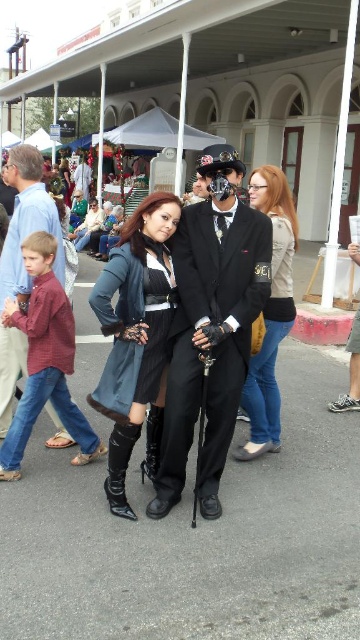
Identify the location of matte black coat at center. The width and height of the screenshot is (360, 640). (136, 339).

Who is positioned more to the right, matte black coat at center or plaid shirt at left?

Positioned to the right is matte black coat at center.

Find the location of a particular element. The height and width of the screenshot is (640, 360). matte black coat at center is located at coordinates pyautogui.click(x=136, y=339).

Does shiny black suit at center have a greater height compared to plaid shirt at left?

Indeed, shiny black suit at center has a greater height compared to plaid shirt at left.

Does shiny black suit at center have a lesser height compared to plaid shirt at left?

No.

Who is more forward, (266, 292) or (16, 368)?

Point (266, 292) is more forward.

You are a GUI agent. You are given a task and a screenshot of the screen. Output one action in this format:
    pyautogui.click(x=<x>, y=<y>)
    Task: Click on the shiny black suit at center
    
    Given the screenshot: What is the action you would take?
    (x=210, y=326)

Does point (78, 452) lie behind point (150, 342)?

Yes, it is.

Can you confirm if maroon cotton shirt at left is shorter than black satin dress at center?

Incorrect, maroon cotton shirt at left's height does not fall short of black satin dress at center's.

Where is `maroon cotton shirt at left`? maroon cotton shirt at left is located at coordinates (45, 358).

At what (x,y) coordinates should I click in order to perform the action: click on maroon cotton shirt at left. Please return your answer as a coordinate pair (x, y). Looking at the image, I should click on (45, 358).